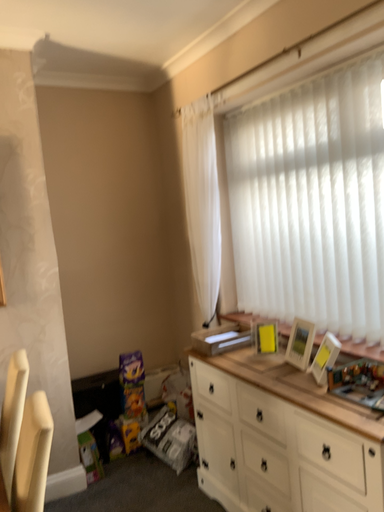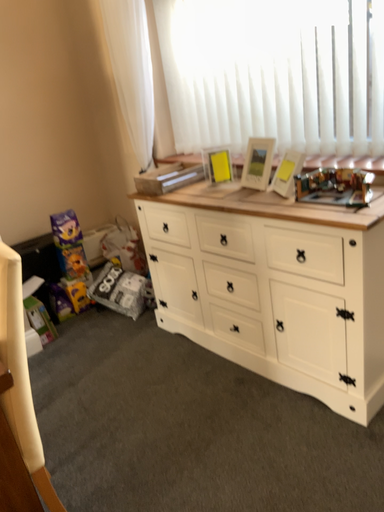
Question: How did the camera likely rotate when shooting the video?

Choices:
 (A) rotated right
 (B) rotated left

Answer: (A)